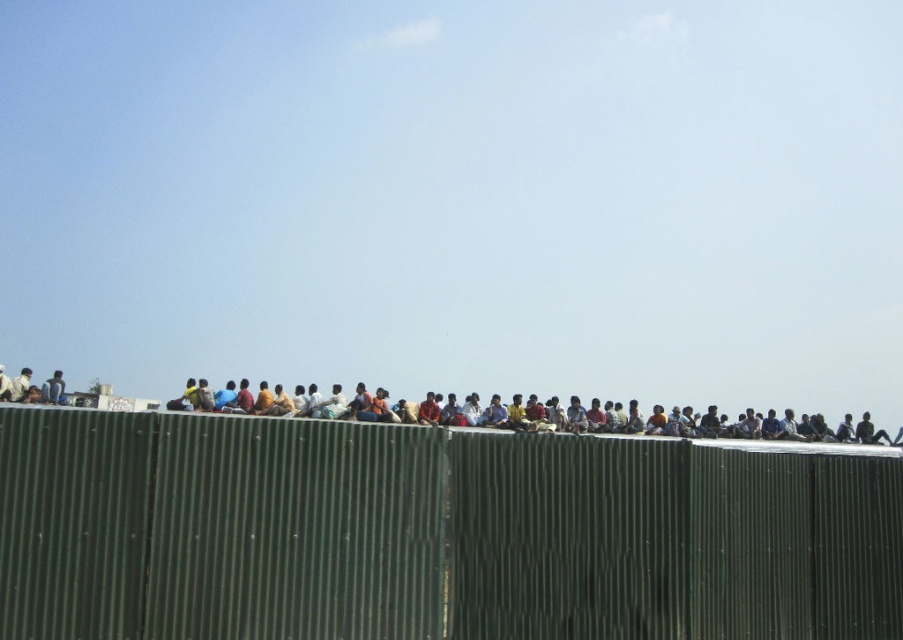
Between green corrugated metal fence at center and dark blue jeans at center, which one has more height?

dark blue jeans at center

Can you confirm if green corrugated metal fence at center is thinner than dark blue jeans at center?

Correct, green corrugated metal fence at center's width is less than dark blue jeans at center's.

Locate an element on the screen. green corrugated metal fence at center is located at coordinates (431, 532).

Where is `green corrugated metal fence at center`? This screenshot has height=640, width=903. green corrugated metal fence at center is located at coordinates (431, 532).